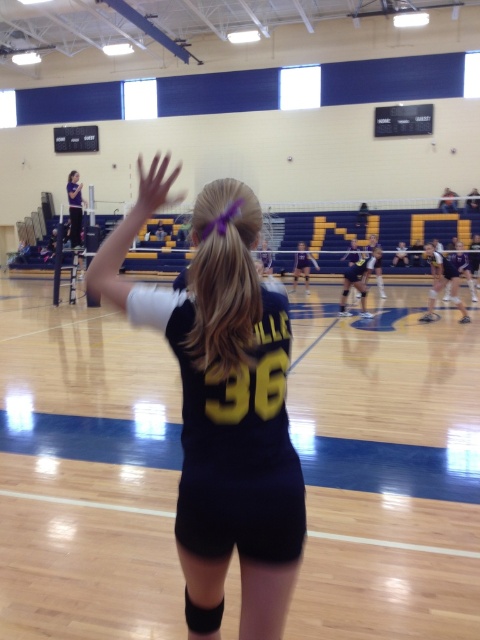
Question: Can you confirm if black jersey at center is bigger than purple jersey at upper left?

Choices:
 (A) no
 (B) yes

Answer: (A)

Question: Which point is farther to the camera?

Choices:
 (A) matte black uniform at center
 (B) black uniform at center
 (C) purple jersey at upper left

Answer: (A)

Question: Which point appears farthest from the camera in this image?

Choices:
 (A) (308, 268)
 (B) (76, 218)
 (C) (455, 288)
 (D) (333, 417)

Answer: (A)

Question: Is black fabric volleyball court at center below black uniform at center?

Choices:
 (A) no
 (B) yes

Answer: (B)

Question: Does black jersey at center appear on the right side of black uniform at center?

Choices:
 (A) no
 (B) yes

Answer: (A)

Question: Which of the following is the closest to the observer?

Choices:
 (A) purple jersey at upper left
 (B) matte black uniform at center
 (C) black jersey at center

Answer: (C)